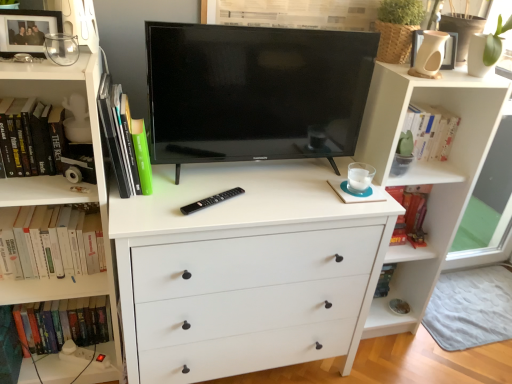
Question: Is point (80, 306) closer or farther from the camera than point (444, 54)?

Choices:
 (A) farther
 (B) closer

Answer: (A)

Question: From their relative heights in the image, would you say hardcover book at left, acting as the fourth book starting from the top, is taller or shorter than matte white picture frame at upper right, acting as the second picture frame starting from the front?

Choices:
 (A) short
 (B) tall

Answer: (B)

Question: Estimate the real-world distances between objects in this image. Which object is closer to the green matte book at left, marked as the second book in a top-to-bottom arrangement?

Choices:
 (A) black plastic remote control at center
 (B) white hardcover book at left, the 3th book in the top-to-bottom sequence
 (C) hardcover book at left, the 1th book in the top-to-bottom sequence
 (D) white matte bookshelf at upper right
 (E) black glossy tv at center

Answer: (C)

Question: Based on their relative distances, which object is nearer to the hardcover book at left, acting as the fourth book starting from the top?

Choices:
 (A) black plastic remote control at center
 (B) green matte book at left, the 3th book positioned from the bottom
 (C) white matte bookshelf at upper right
 (D) hardcover book at left, the 1th book in the top-to-bottom sequence
 (E) matte black picture frame at upper left, the 1th picture frame positioned from the left

Answer: (D)